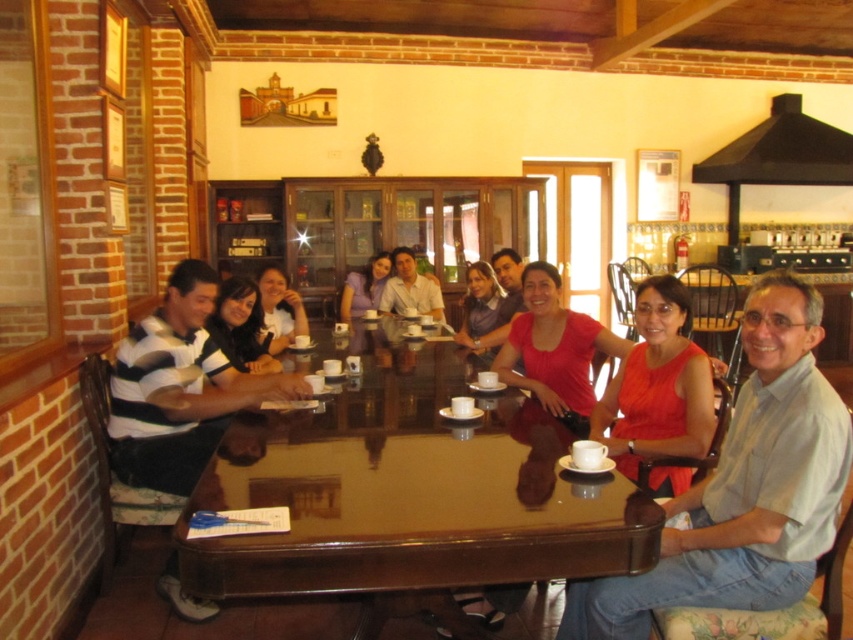
Does matte black shirt at center appear on the right side of matte white shirt at center?

Incorrect, matte black shirt at center is not on the right side of matte white shirt at center.

Consider the image. Who is positioned more to the left, matte black shirt at center or matte white shirt at center?

matte black shirt at center is more to the left.

Image resolution: width=853 pixels, height=640 pixels. Find the location of `matte black shirt at center`. matte black shirt at center is located at coordinates pos(241,326).

Locate an element on the screen. The height and width of the screenshot is (640, 853). matte black shirt at center is located at coordinates (241, 326).

Can you confirm if matte red dress at center is positioned to the left of matte black shirt at center?

No, matte red dress at center is not to the left of matte black shirt at center.

Which is more to the right, matte red dress at center or matte black shirt at center?

matte red dress at center

Does point (636, 376) come closer to viewer compared to point (247, 307)?

That is True.

At what (x,y) coordinates should I click in order to perform the action: click on matte red dress at center. Please return your answer as a coordinate pair (x, y). The image size is (853, 640). Looking at the image, I should click on (659, 385).

Between striped cotton shirt at center and white matte shirt at center, which one has more height?

Standing taller between the two is striped cotton shirt at center.

What do you see at coordinates (178, 388) in the screenshot?
I see `striped cotton shirt at center` at bounding box center [178, 388].

You are a GUI agent. You are given a task and a screenshot of the screen. Output one action in this format:
    pyautogui.click(x=<x>, y=<y>)
    Task: Click on the striped cotton shirt at center
    
    Given the screenshot: What is the action you would take?
    pyautogui.click(x=178, y=388)